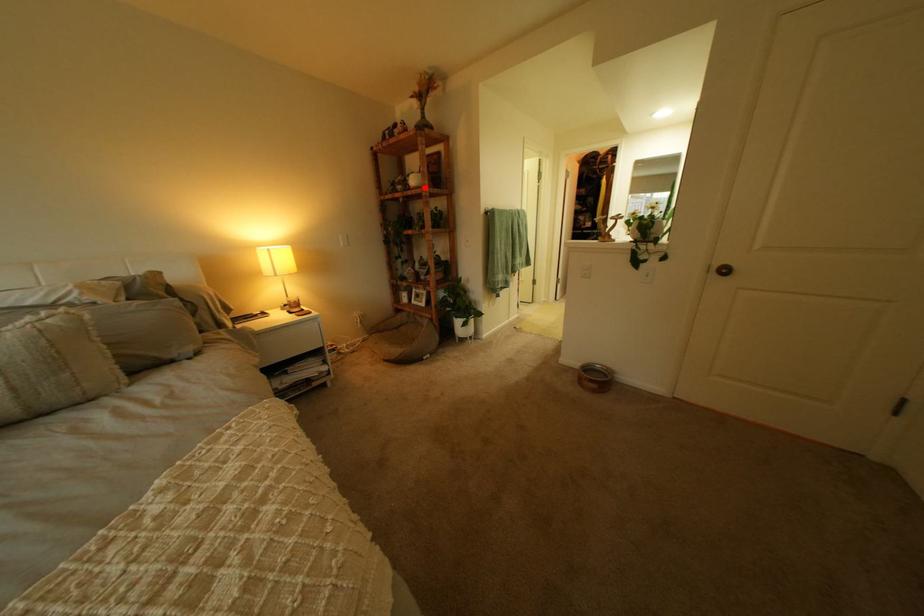
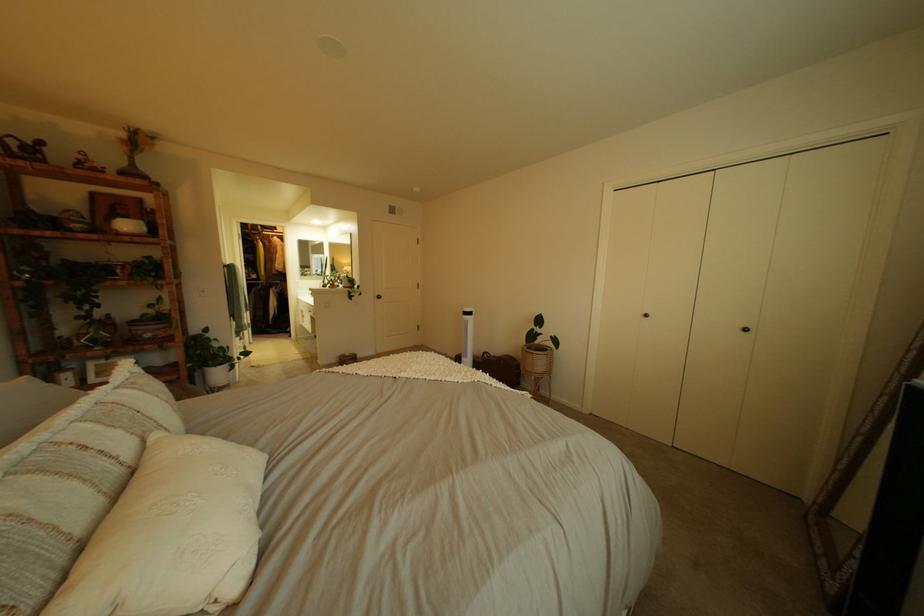
Question: I am providing you with two images of the same scene from different viewpoints. In image1, a red point is highlighted. Considering the same 3D point in image2, which of the following is correct?

Choices:
 (A) It is closer
 (B) It is farther

Answer: (B)